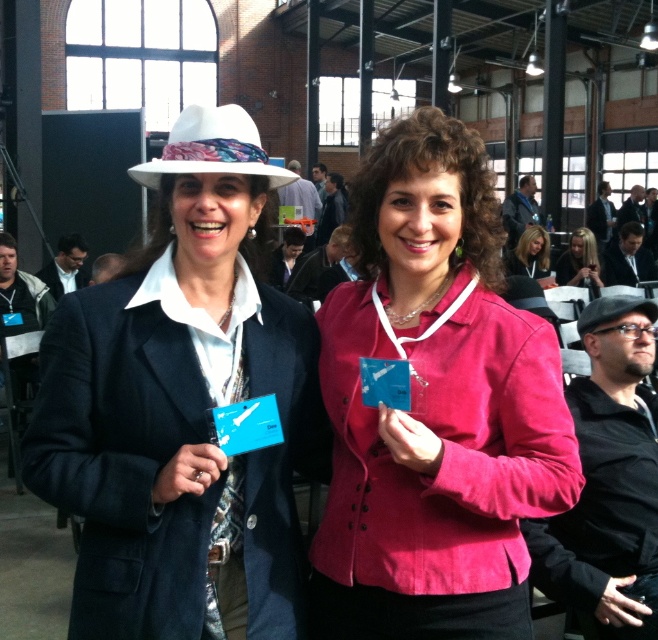
Which of these two, matte black blazer at center or pink fabric jacket at center, stands taller?

pink fabric jacket at center is taller.

Looking at this image, between matte black blazer at center and pink fabric jacket at center, which one appears on the left side from the viewer's perspective?

matte black blazer at center is more to the left.

Which is behind, point (126, 589) or point (405, 545)?

The point (405, 545) is behind.

The image size is (658, 640). Find the location of `matte black blazer at center`. matte black blazer at center is located at coordinates (182, 410).

From the picture: Measure the distance from matte black blazer at center to black fabric hat at right.

matte black blazer at center is 7.13 feet from black fabric hat at right.

Does point (263, 620) come farther from viewer compared to point (601, 305)?

No, (263, 620) is in front of (601, 305).

The height and width of the screenshot is (640, 658). Find the location of `matte black blazer at center`. matte black blazer at center is located at coordinates (182, 410).

Find the location of `matte black blazer at center`. matte black blazer at center is located at coordinates (182, 410).

Based on the photo, which is more to the left, pink fabric jacket at center or matte pink blazer at center?

From the viewer's perspective, pink fabric jacket at center appears more on the left side.

Between point (461, 298) and point (538, 260), which one is positioned in front?

Point (461, 298)

Between point (482, 195) and point (540, 250), which one is positioned behind?

Positioned behind is point (540, 250).

At what (x,y) coordinates should I click in order to perform the action: click on pink fabric jacket at center. Please return your answer as a coordinate pair (x, y). This screenshot has height=640, width=658. Looking at the image, I should click on 434,406.